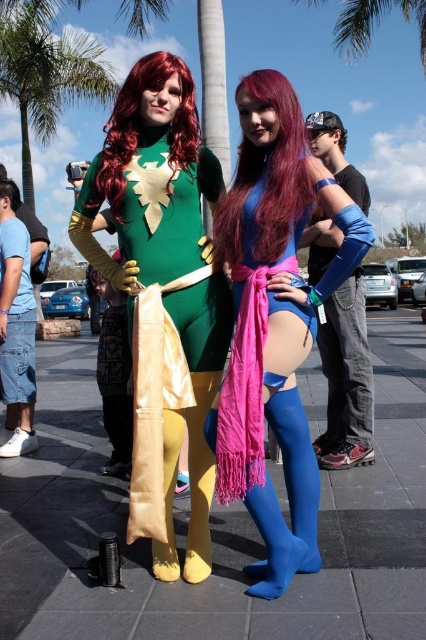
Can you confirm if blue spandex leggings at center is wider than green leafy palm tree at upper center?

Indeed, blue spandex leggings at center has a greater width compared to green leafy palm tree at upper center.

The image size is (426, 640). What do you see at coordinates (273, 321) in the screenshot?
I see `blue spandex leggings at center` at bounding box center [273, 321].

You are a GUI agent. You are given a task and a screenshot of the screen. Output one action in this format:
    pyautogui.click(x=<x>, y=<y>)
    Task: Click on the blue spandex leggings at center
    This screenshot has height=640, width=426.
    Given the screenshot: What is the action you would take?
    pyautogui.click(x=273, y=321)

Does point (161, 132) come closer to viewer compared to point (362, 49)?

Yes, point (161, 132) is in front of point (362, 49).

Is green matte bodysuit at center bigger than green leafy palm tree at upper center?

Yes.

Is point (112, 189) positioned in front of point (360, 10)?

Yes, it is.

The image size is (426, 640). What are the coordinates of `green matte bodysuit at center` in the screenshot? It's located at (166, 262).

Who is more forward, (288, 122) or (157, 545)?

Point (288, 122) is more forward.

Looking at this image, is blue spandex leggings at center to the left of green matte bodysuit at center from the viewer's perspective?

No, blue spandex leggings at center is not to the left of green matte bodysuit at center.

Who is more distant from viewer, (287, 304) or (144, 61)?

Point (144, 61)

This screenshot has width=426, height=640. I want to click on blue spandex leggings at center, so click(273, 321).